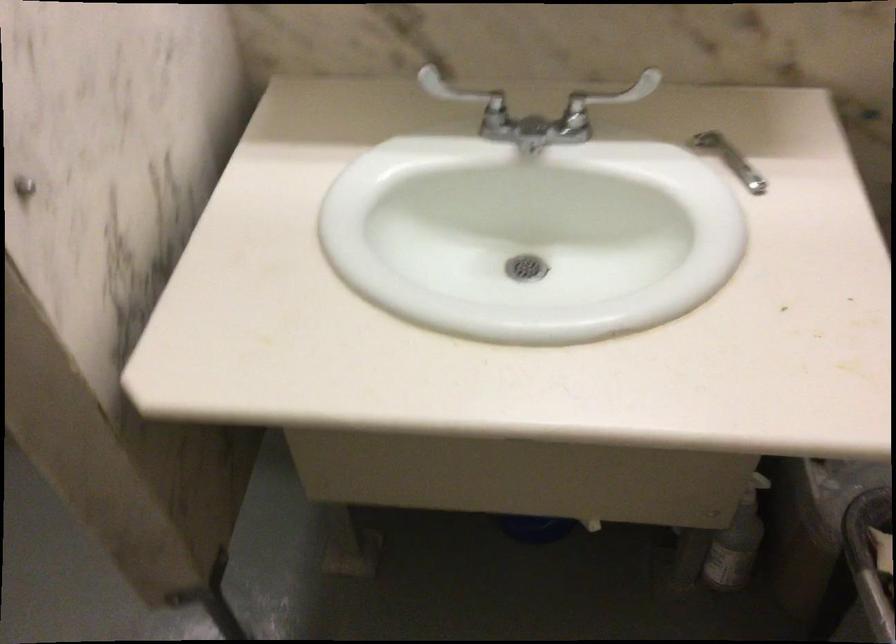
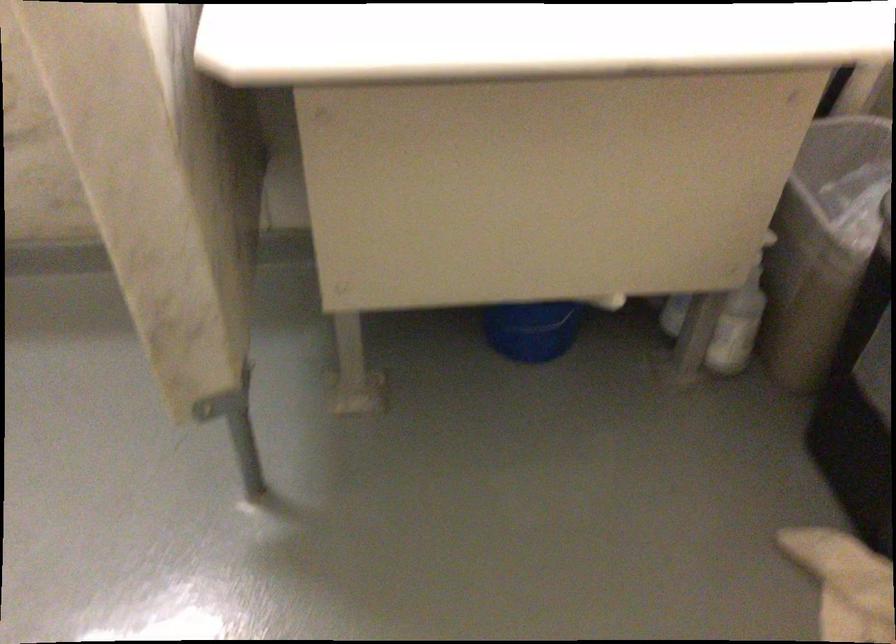
Question: The first image is from the beginning of the video and the second image is from the end. How did the camera likely rotate when shooting the video?

Choices:
 (A) Left
 (B) Right
 (C) Up
 (D) Down

Answer: (B)